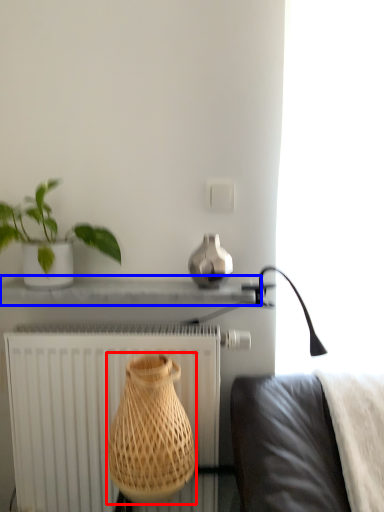
Question: Which object is closer to the camera taking this photo, vase (highlighted by a red box) or window sill (highlighted by a blue box)?

Choices:
 (A) vase
 (B) window sill

Answer: (A)